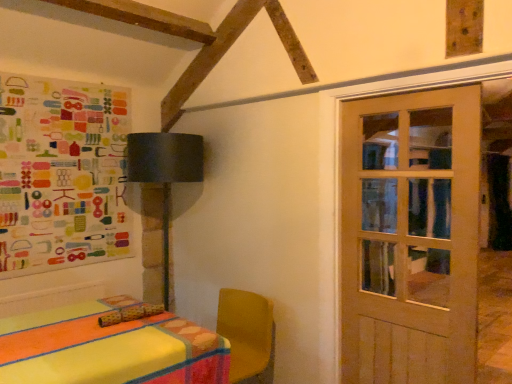
What is the approximate height of wooden door at right?

5.06 feet.

Where is `matte black lampshade at upper left`? matte black lampshade at upper left is located at coordinates (165, 172).

The width and height of the screenshot is (512, 384). What do you see at coordinates (62, 174) in the screenshot?
I see `colorful paper collage at upper left` at bounding box center [62, 174].

What are the coordinates of `wooden door at right` in the screenshot? It's located at pyautogui.click(x=410, y=237).

Is matte black lampshade at upper left next to wooden door at right and touching it?

No, matte black lampshade at upper left is not next to wooden door at right.

Where is `table lamp on the left of the wooden door at right`? Image resolution: width=512 pixels, height=384 pixels. table lamp on the left of the wooden door at right is located at coordinates (165, 172).

Considering the relative sizes of matte black lampshade at upper left and wooden door at right in the image provided, is matte black lampshade at upper left smaller than wooden door at right?

No, matte black lampshade at upper left is not smaller than wooden door at right.

Consider the image. How many degrees apart are the facing directions of wooden door at right and colorful paper collage at upper left?

The angle between the facing direction of wooden door at right and the facing direction of colorful paper collage at upper left is 89.1 degrees.

Is colorful paper collage at upper left a part of wooden door at right?

No, colorful paper collage at upper left is located outside of wooden door at right.

From the image's perspective, who appears lower, wooden door at right or colorful paper collage at upper left?

wooden door at right.

Is wooden door at right oriented away from colorful paper collage at upper left?

wooden door at right is not turned away from colorful paper collage at upper left.

Which is less distant, (170, 176) or (19, 121)?

Positioned in front is point (19, 121).

There is a matte black lampshade at upper left. Where is `bulletin board above it (from a real-world perspective)`? This screenshot has width=512, height=384. bulletin board above it (from a real-world perspective) is located at coordinates (62, 174).

Which object is more forward, matte black lampshade at upper left or colorful paper collage at upper left?

Positioned in front is colorful paper collage at upper left.

From the image's perspective, is matte black lampshade at upper left above or below colorful paper collage at upper left?

matte black lampshade at upper left is situated lower than colorful paper collage at upper left in the image.

Does wooden door at right come in front of matte black lampshade at upper left?

Yes, the depth of wooden door at right is less than that of matte black lampshade at upper left.

Is wooden door at right not inside matte black lampshade at upper left?

Indeed, wooden door at right is completely outside matte black lampshade at upper left.

Considering the points (406, 328) and (127, 166), which point is behind, point (406, 328) or point (127, 166)?

The point (127, 166) is farther from the camera.

Considering the relative sizes of wooden door at right and matte black lampshade at upper left in the image provided, is wooden door at right shorter than matte black lampshade at upper left?

Incorrect, the height of wooden door at right does not fall short of that of matte black lampshade at upper left.

Based on their positions, is colorful paper collage at upper left located to the left or right of matte black lampshade at upper left?

From the image, it's evident that colorful paper collage at upper left is to the left of matte black lampshade at upper left.

Does point (113, 142) come in front of point (162, 176)?

No, (113, 142) is behind (162, 176).

Is colorful paper collage at upper left shorter than matte black lampshade at upper left?

Correct, colorful paper collage at upper left is not as tall as matte black lampshade at upper left.

Considering the sizes of colorful paper collage at upper left and wooden door at right in the image, is colorful paper collage at upper left wider or thinner than wooden door at right?

Considering their sizes, colorful paper collage at upper left looks broader than wooden door at right.

From a real-world perspective, which object stands above the other?

In real-world perspective, colorful paper collage at upper left is above.

Where is `bulletin board behind the wooden door at right`? The height and width of the screenshot is (384, 512). bulletin board behind the wooden door at right is located at coordinates (62, 174).

From the image's perspective, which object appears higher, colorful paper collage at upper left or wooden door at right?

From the image's view, colorful paper collage at upper left is above.

Where is `door that appears in front of the matte black lampshade at upper left`? door that appears in front of the matte black lampshade at upper left is located at coordinates (410, 237).

I want to click on bulletin board that is above the wooden door at right (from the image's perspective), so click(62, 174).

Considering their positions, is wooden door at right positioned closer to colorful paper collage at upper left than matte black lampshade at upper left?

matte black lampshade at upper left.

Which object lies nearer to the anchor point matte black lampshade at upper left, wooden door at right or colorful paper collage at upper left?

colorful paper collage at upper left is closer to matte black lampshade at upper left.

Estimate the real-world distances between objects in this image. Which object is further from colorful paper collage at upper left, matte black lampshade at upper left or wooden door at right?

wooden door at right is further to colorful paper collage at upper left.

Considering their positions, is colorful paper collage at upper left positioned further to matte black lampshade at upper left than wooden door at right?

wooden door at right is further to matte black lampshade at upper left.

When comparing their distances from wooden door at right, does colorful paper collage at upper left or matte black lampshade at upper left seem further?

colorful paper collage at upper left.

Based on their spatial positions, is matte black lampshade at upper left or colorful paper collage at upper left closer to wooden door at right?

matte black lampshade at upper left.

Locate an element on the screen. The width and height of the screenshot is (512, 384). table lamp between colorful paper collage at upper left and wooden door at right in the horizontal direction is located at coordinates (165, 172).